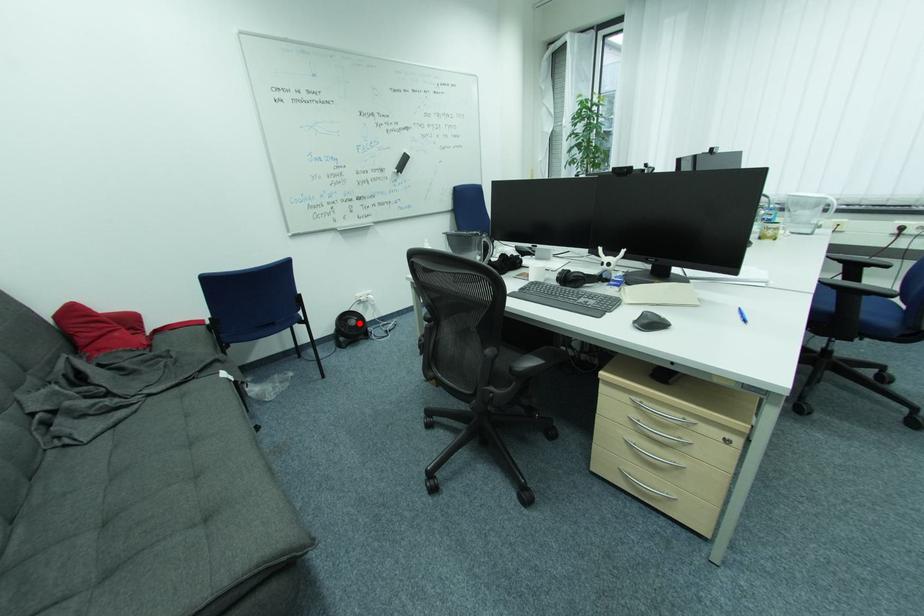
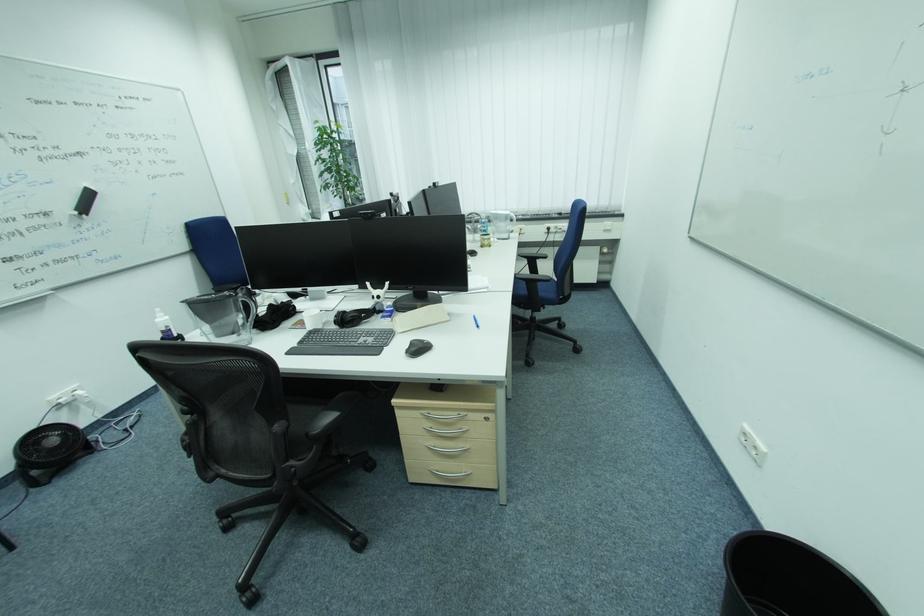
Find the pixel in the second image that matches the highlighted location in the first image.

(59, 442)